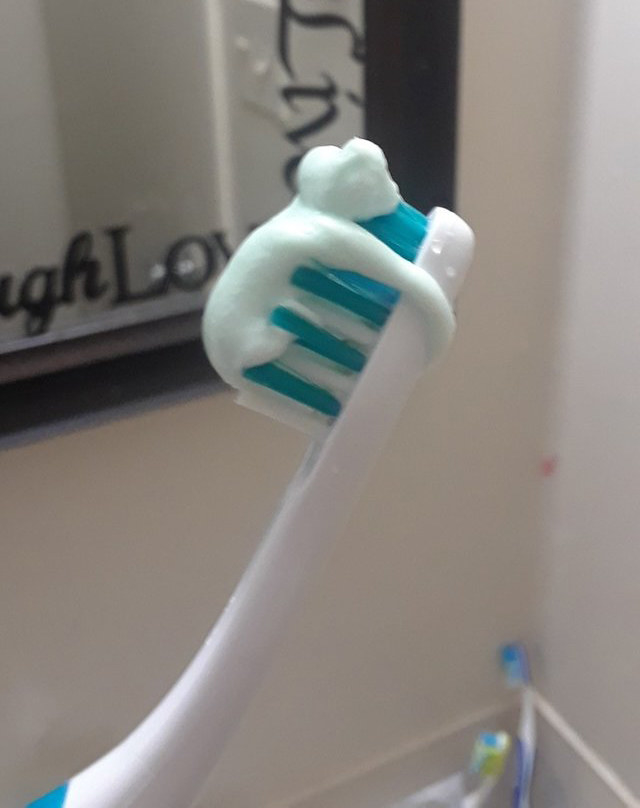
At what (x,y) coordinates should I click in order to perform the action: click on mirrow. Please return your answer as a coordinate pair (x, y). The height and width of the screenshot is (808, 640). Looking at the image, I should click on (221, 175).